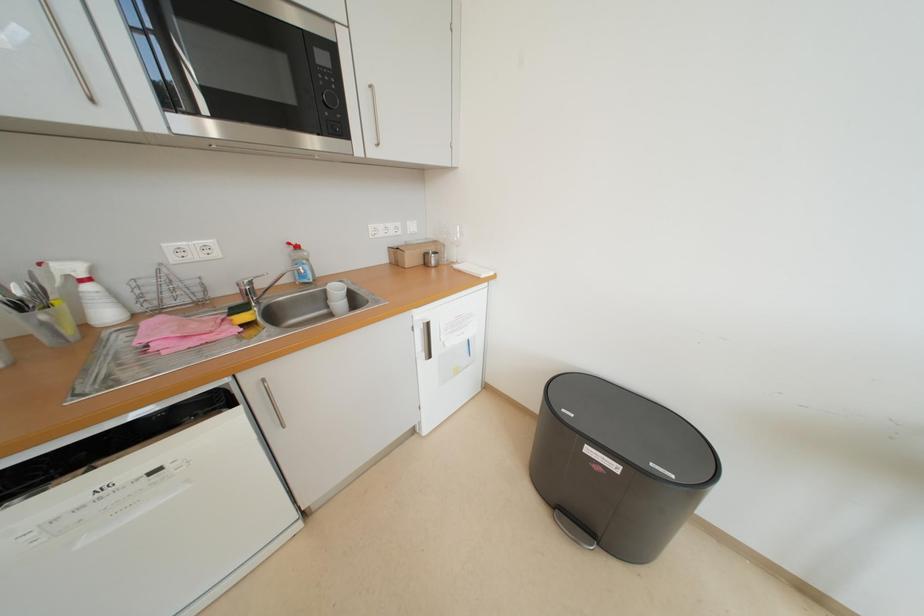
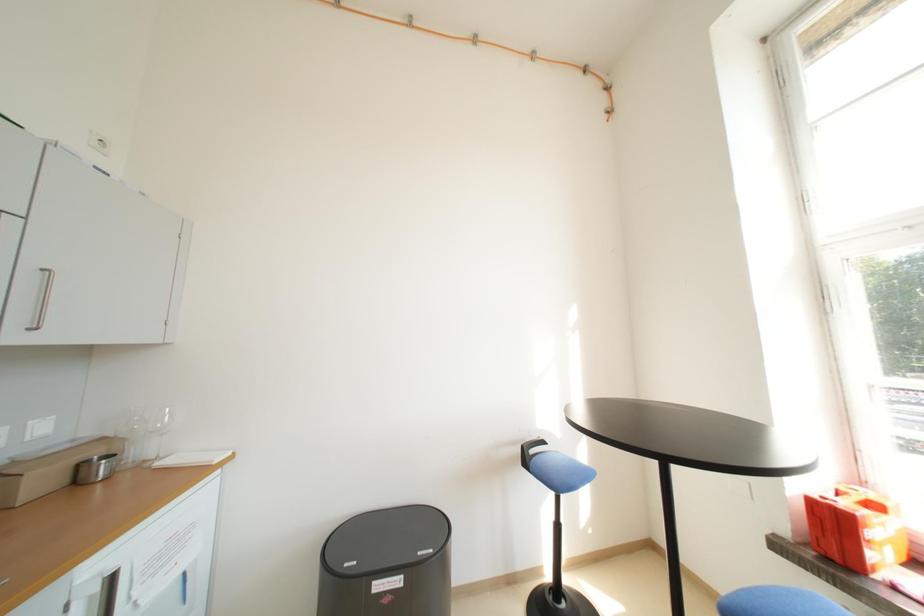
The first image is from the beginning of the video and the second image is from the end. How did the camera likely rotate when shooting the video?

The rotation direction of the camera is right-up.